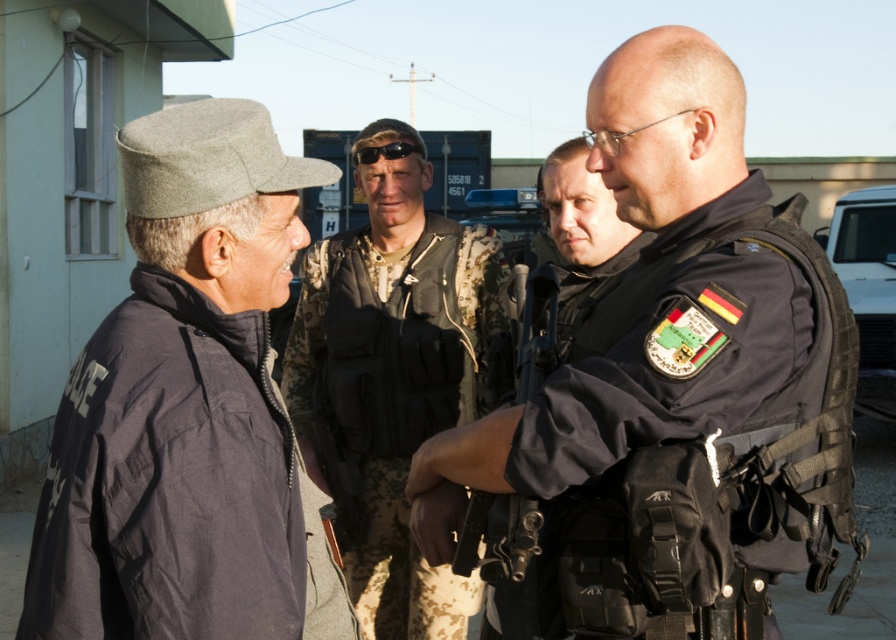
Which is above, black tactical vest at center or camouflage fabric vest at center?

Positioned higher is black tactical vest at center.

Who is positioned more to the right, black tactical vest at center or camouflage fabric vest at center?

black tactical vest at center is more to the right.

Where is `black tactical vest at center`? black tactical vest at center is located at coordinates (688, 330).

Is dark gray woolen hat at left further to camera compared to camouflage fabric vest at center?

No, dark gray woolen hat at left is in front of camouflage fabric vest at center.

Who is more forward, (39, 573) or (442, 256)?

Point (39, 573) is in front.

At what (x,y) coordinates should I click in order to perform the action: click on dark gray woolen hat at left. Please return your answer as a coordinate pair (x, y). Looking at the image, I should click on (182, 403).

Where is `dark gray woolen hat at left`? This screenshot has height=640, width=896. dark gray woolen hat at left is located at coordinates pyautogui.click(x=182, y=403).

Between black tactical vest at center and dark gray woolen hat at left, which one has less height?

With less height is dark gray woolen hat at left.

The width and height of the screenshot is (896, 640). Describe the element at coordinates (688, 330) in the screenshot. I see `black tactical vest at center` at that location.

Is point (419, 474) in front of point (254, 532)?

No, it is not.

The height and width of the screenshot is (640, 896). What are the coordinates of `black tactical vest at center` in the screenshot? It's located at (688, 330).